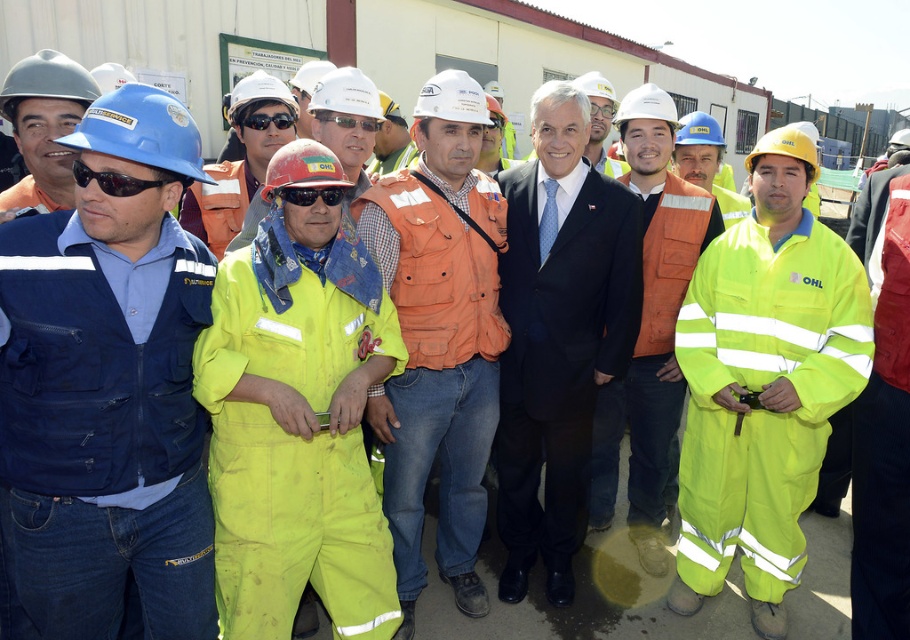
You are an observer at the construction site. You notice two items in the scene. One is the blue fabric jacket at left and the other is the matte white goggles at center. Which of these two items appears larger in size?

The blue fabric jacket at left is bigger than the matte white goggles at center, so the blue fabric jacket at left appears larger in size.

You are a safety inspector at the construction site. You notice two workers wearing neon yellow coveralls at center and matte black suit at center. Which worker is easier to spot from a distance?

The neon yellow coveralls at center is closer to the viewer than the matte black suit at center, so the worker in neon yellow coveralls at center is easier to spot from a distance because they are nearer.

You are a safety inspector at the construction site. You need to ensure that all safety gear is properly worn. You see the orange fabric vest at center and the black reflective goggles at center. Are these two items worn by the same person?

The distance between the orange fabric vest at center and black reflective goggles at center is 37.66 inches, which is too far to be worn by the same person. Therefore, these items are likely not worn by the same individual.